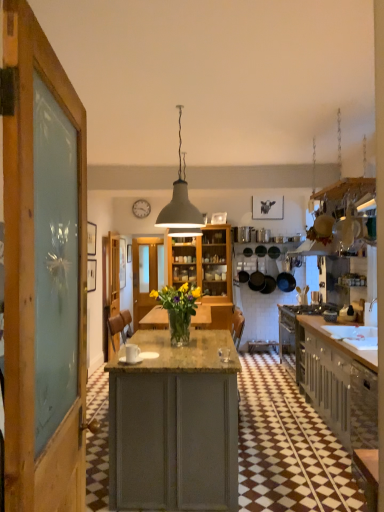
Describe the element at coordinates (110, 286) in the screenshot. I see `wooden door at center` at that location.

Identify the location of wooden door at center. (110, 286).

Measure the distance between white matte pendant light at center and camera.

The distance of white matte pendant light at center from camera is 10.10 feet.

In order to click on translucent glass vase at center in this screenshot , I will do `click(178, 310)`.

Measure the distance between point (166, 309) and camera.

Point (166, 309) and camera are 10.71 feet apart from each other.

I want to click on wooden door at center, so click(x=110, y=286).

Is the surface of translucent glass vase at center in direct contact with wooden door at center?

No, translucent glass vase at center is not touching wooden door at center.

From a real-world perspective, which object stands above the other?

wooden door at center.

In terms of width, does translucent glass vase at center look wider or thinner when compared to wooden door at center?

In the image, translucent glass vase at center appears to be wider than wooden door at center.

Considering the positions of objects translucent glass vase at center and transparent glass door at center in the image provided, who is more to the right, translucent glass vase at center or transparent glass door at center?

From the viewer's perspective, translucent glass vase at center appears more on the right side.

Is the depth of translucent glass vase at center less than that of transparent glass door at center?

Yes, it is.

From the image's perspective, is translucent glass vase at center under transparent glass door at center?

No, from the image's perspective, translucent glass vase at center is not below transparent glass door at center.

Would you consider translucent glass vase at center to be distant from transparent glass door at center?

That's right, there is a large distance between translucent glass vase at center and transparent glass door at center.

Can you confirm if white matte pendant light at center is taller than transparent glass door at center?

Incorrect, the height of white matte pendant light at center is not larger of that of transparent glass door at center.

Considering the positions of objects white matte pendant light at center and transparent glass door at center in the image provided, who is more to the right, white matte pendant light at center or transparent glass door at center?

From the viewer's perspective, white matte pendant light at center appears more on the right side.

Between white matte pendant light at center and transparent glass door at center, which one has larger size?

Bigger between the two is transparent glass door at center.

Which point is more distant from viewer, (174,200) or (148,250)?

The point (148,250) is farther from the camera.

From the image's perspective, who appears lower, matte gray cabinets at right or translucent glass vase at center?

matte gray cabinets at right is shown below in the image.

Can we say matte gray cabinets at right lies outside translucent glass vase at center?

Yes, matte gray cabinets at right is not within translucent glass vase at center.

How many degrees apart are the facing directions of matte gray cabinets at right and translucent glass vase at center?

There is a 178-degree angle between the facing directions of matte gray cabinets at right and translucent glass vase at center.

Is matte gray cabinets at right looking in the opposite direction of translucent glass vase at center?

matte gray cabinets at right is not turned away from translucent glass vase at center.

Is wooden door at center shorter than transparent glass door at center?

Correct, wooden door at center is not as tall as transparent glass door at center.

Is wooden door at center directly adjacent to transparent glass door at center?

wooden door at center and transparent glass door at center are clearly separated.

Is transparent glass door at center at the back of wooden door at center?

No, wooden door at center is not facing the opposite direction of transparent glass door at center.

Is wooden door at center surrounding transparent glass door at center?

Definitely not — transparent glass door at center is not inside wooden door at center.

Does transparent glass door at center come in front of translucent glass vase at center?

No, transparent glass door at center is further to the viewer.

From a real-world perspective, between transparent glass door at center and translucent glass vase at center, who is vertically higher?

transparent glass door at center, from a real-world perspective.

Is transparent glass door at center in contact with translucent glass vase at center?

No.

Is transparent glass door at center facing towards translucent glass vase at center?

Yes.

Is matte gray cabinets at right positioned with its back to wooden door at center?

matte gray cabinets at right is not turned away from wooden door at center.

Is matte gray cabinets at right surrounding wooden door at center?

No, wooden door at center is not inside matte gray cabinets at right.

Is matte gray cabinets at right placed right next to wooden door at center?

No, matte gray cabinets at right is not touching wooden door at center.

Which of these two, matte gray cabinets at right or wooden door at center, is bigger?

matte gray cabinets at right.

I want to click on floral arrangement below the wooden door at center (from the image's perspective), so point(178,310).

In order to click on glass door that appears behind the translucent glass vase at center in this screenshot , I will do `click(145, 274)`.

When comparing their distances from matte gray cabinets at right, does translucent glass vase at center or wooden door at center seem closer?

translucent glass vase at center is closer to matte gray cabinets at right.

Based on their spatial positions, is matte gray cabinets at right or wooden door at center further from transparent glass door at center?

Based on the image, matte gray cabinets at right appears to be further to transparent glass door at center.

Which object lies nearer to the anchor point translucent glass vase at center, wooden door at center or transparent glass door at center?

wooden door at center.

From the image, which object appears to be farther from translucent glass vase at center, matte gray cabinets at right or wooden door at center?

Based on the image, wooden door at center appears to be further to translucent glass vase at center.

Considering their positions, is transparent glass door at center positioned further to translucent glass vase at center than matte gray cabinets at right?

Based on the image, transparent glass door at center appears to be further to translucent glass vase at center.

Looking at the image, which one is located further to white matte pendant light at center, wooden door at center or translucent glass vase at center?

wooden door at center is positioned further to the anchor white matte pendant light at center.

Based on their spatial positions, is translucent glass vase at center or transparent glass door at center closer to white matte pendant light at center?

translucent glass vase at center is positioned closer to the anchor white matte pendant light at center.

Estimate the real-world distances between objects in this image. Which object is closer to white matte pendant light at center, translucent glass vase at center or wooden door at center?

Based on the image, translucent glass vase at center appears to be nearer to white matte pendant light at center.

Where is `floral arrangement located between white matte pendant light at center and matte gray cabinets at right in the left-right direction`? Image resolution: width=384 pixels, height=512 pixels. floral arrangement located between white matte pendant light at center and matte gray cabinets at right in the left-right direction is located at coordinates (178, 310).

Locate an element on the screen. The height and width of the screenshot is (512, 384). floral arrangement between matte gray cabinets at right and transparent glass door at center from front to back is located at coordinates (178, 310).

Locate an element on the screen. door between translucent glass vase at center and transparent glass door at center from front to back is located at coordinates (110, 286).

Where is `floral arrangement positioned between matte gray cabinets at right and wooden door at center from near to far`? The width and height of the screenshot is (384, 512). floral arrangement positioned between matte gray cabinets at right and wooden door at center from near to far is located at coordinates (178, 310).